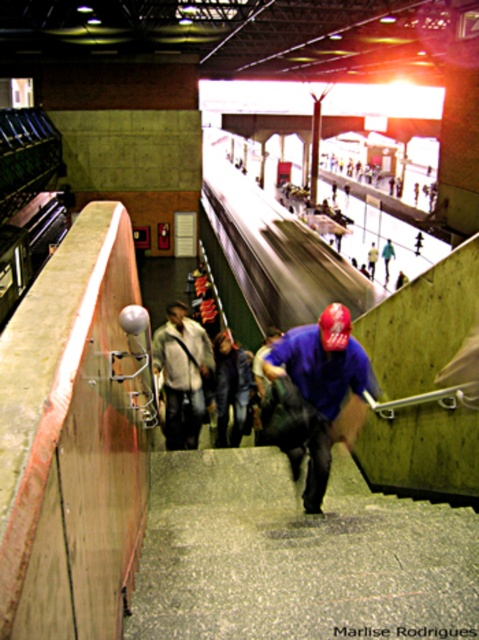
You are standing at the top of the subway station stairs and see a person wearing a light brown leather jacket at center and a dark blue shirt at center. Which clothing item is taller?

The light brown leather jacket at center is much taller than the dark blue shirt at center.